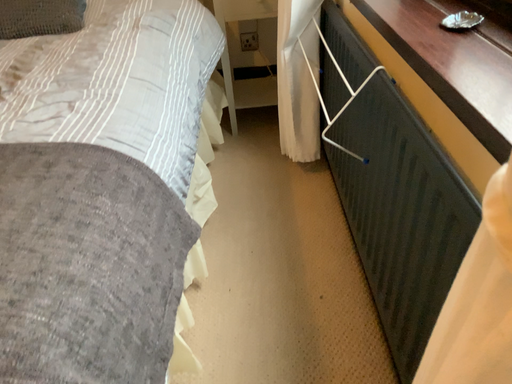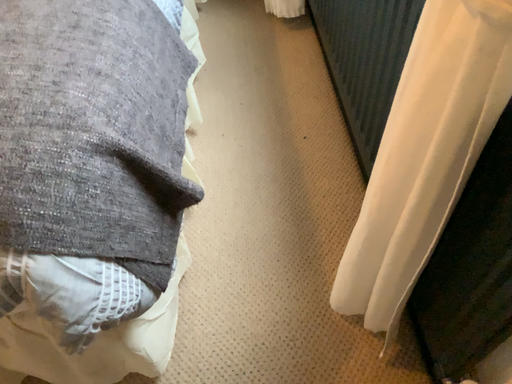
Question: Which way did the camera rotate in the video?

Choices:
 (A) rotated downward
 (B) rotated upward

Answer: (A)